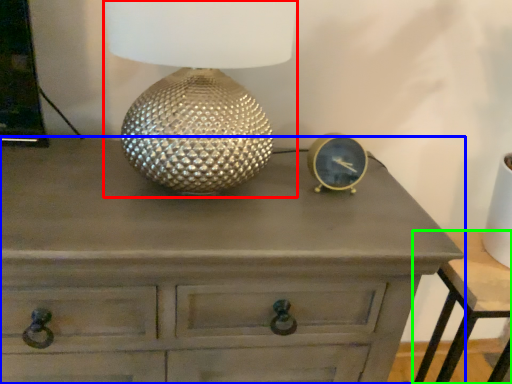
Question: Which is nearer to the table lamp (highlighted by a red box)? chest of drawers (highlighted by a blue box) or nightstand (highlighted by a green box).

Choices:
 (A) chest of drawers
 (B) nightstand

Answer: (A)